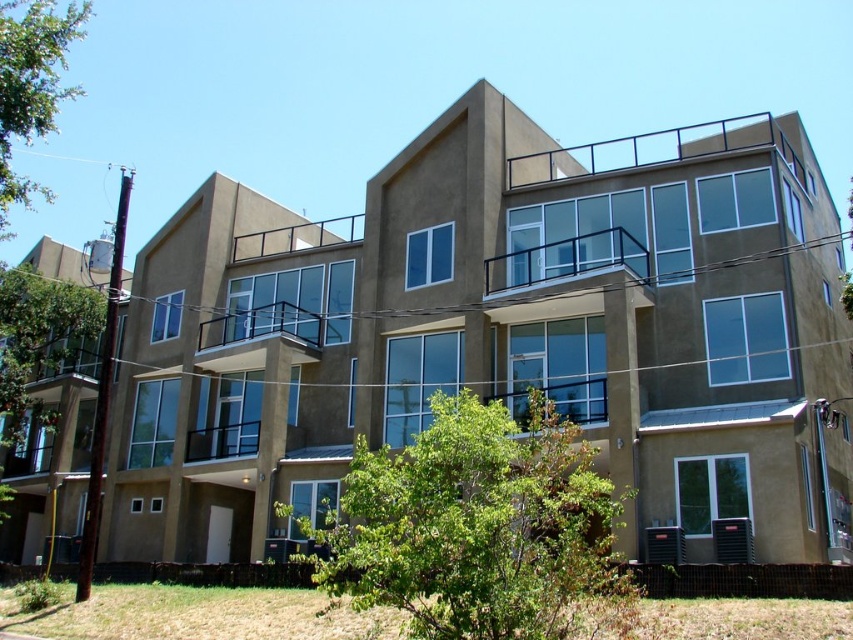
Question: Is green leafy tree at left to the left of black metal balcony at upper center from the viewer's perspective?

Choices:
 (A) yes
 (B) no

Answer: (A)

Question: Which point is closer to the camera?

Choices:
 (A) green leafy tree at upper left
 (B) black metal balcony at upper center
 (C) metallic railing at upper center

Answer: (B)

Question: Which of the following is the farthest from the observer?

Choices:
 (A) (229, 339)
 (B) (439, 588)
 (C) (791, 172)
 (D) (602, 253)

Answer: (A)

Question: Which point is farther from the camera taking this photo?

Choices:
 (A) (515, 177)
 (B) (381, 602)
 (C) (35, 296)

Answer: (C)

Question: Observing the image, what is the correct spatial positioning of green leafy tree at center in reference to black metal balcony at upper center?

Choices:
 (A) left
 (B) right

Answer: (A)

Question: Can you confirm if black metal railing at upper center is bigger than metallic railing at upper center?

Choices:
 (A) no
 (B) yes

Answer: (B)